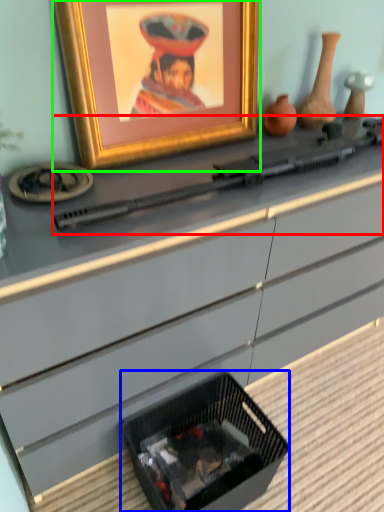
Question: Estimate the real-world distances between objects in this image. Which object is farther from weapon (highlighted by a red box), basket (highlighted by a blue box) or picture frame (highlighted by a green box)?

Choices:
 (A) basket
 (B) picture frame

Answer: (A)